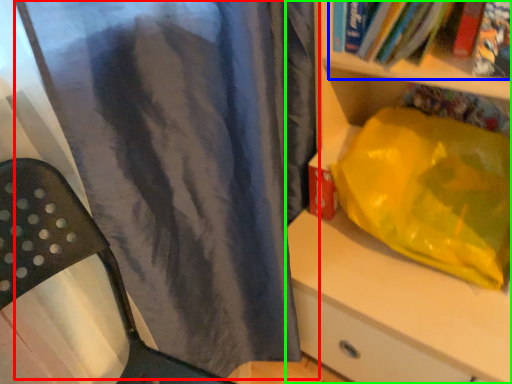
Question: Estimate the real-world distances between objects in this image. Which object is closer to curtain (highlighted by a red box), book (highlighted by a blue box) or shelf (highlighted by a green box)?

Choices:
 (A) book
 (B) shelf

Answer: (B)